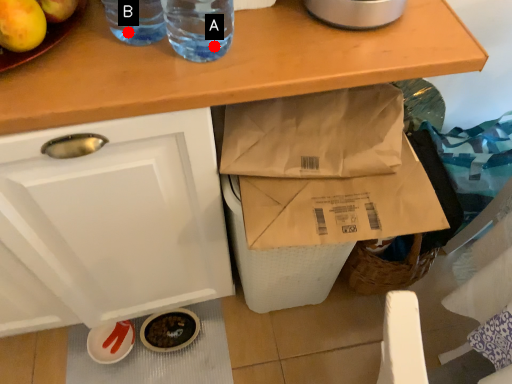
Question: Two points are circled on the image, labeled by A and B beside each circle. Which point appears closest to the camera in this image?

Choices:
 (A) A is closer
 (B) B is closer

Answer: (B)